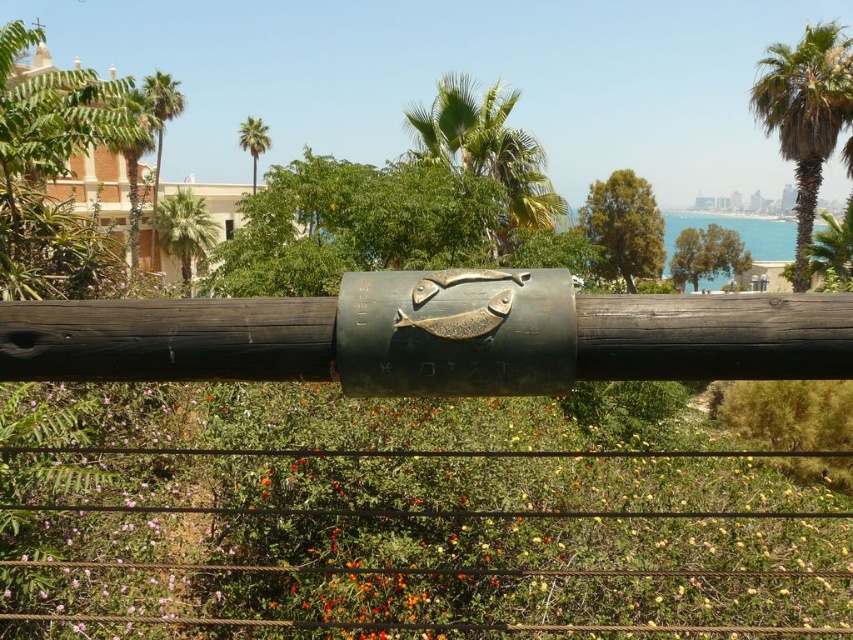
Question: Does green leafy palm tree at center have a smaller size compared to green leafy palm tree at upper left?

Choices:
 (A) no
 (B) yes

Answer: (A)

Question: From the image, what is the correct spatial relationship of bronze textured pole at center in relation to green leafy palm tree at center?

Choices:
 (A) above
 (B) below

Answer: (B)

Question: Which object is the closest to the bronze textured pole at center?

Choices:
 (A) green leafy palm at upper center
 (B) green leafy palm tree at upper center

Answer: (B)

Question: Which object appears farthest from the camera in this image?

Choices:
 (A) green leafy palm tree at upper center
 (B) green leafy palm at upper center

Answer: (B)

Question: Can you confirm if green leafy palm tree at upper right is positioned to the left of green leafy palm tree at center?

Choices:
 (A) no
 (B) yes

Answer: (A)

Question: Which point is closer to the camera?

Choices:
 (A) (247, 120)
 (B) (187, 269)
 (C) (171, 104)

Answer: (C)